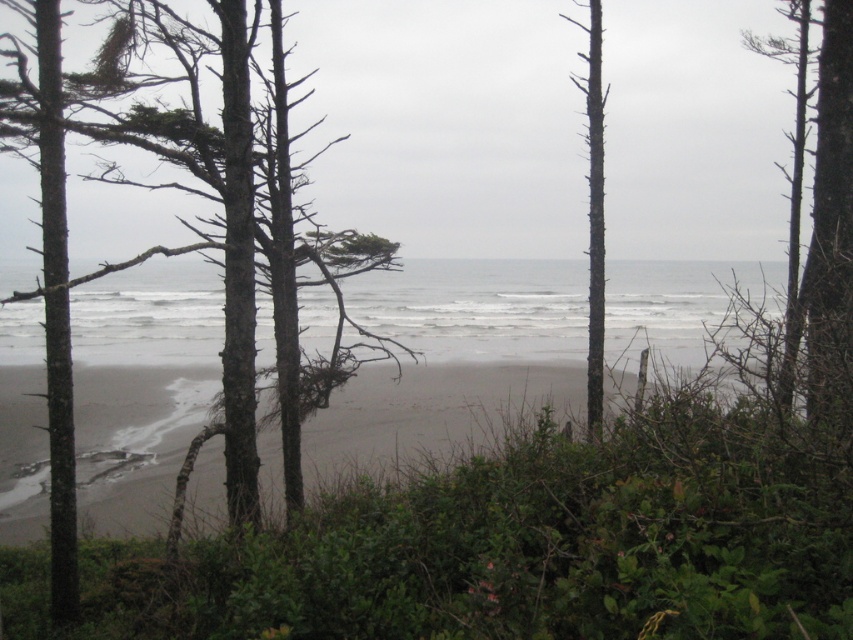
Question: Which point is closer to the camera?

Choices:
 (A) (281, 388)
 (B) (132, 368)
 (C) (801, 67)

Answer: (A)

Question: Does smooth gray bark tree at center have a smaller size compared to smooth bark tree at right?

Choices:
 (A) yes
 (B) no

Answer: (A)

Question: Does gray sand at center have a greater width compared to smooth gray bark tree at center?

Choices:
 (A) yes
 (B) no

Answer: (A)

Question: Among these objects, which one is farthest from the camera?

Choices:
 (A) smooth gray bark tree at center
 (B) gray sand at center

Answer: (A)

Question: Can you confirm if gray sand at center is smaller than smooth bark tree at center?

Choices:
 (A) yes
 (B) no

Answer: (A)

Question: Among these objects, which one is farthest from the camera?

Choices:
 (A) gray sand at center
 (B) smooth bark tree at center
 (C) smooth gray bark tree at center

Answer: (B)